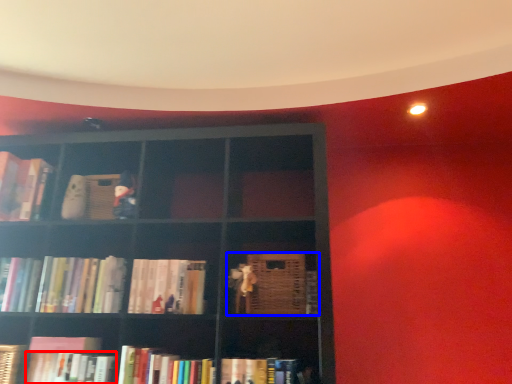
Question: Which object is further to the camera taking this photo, book (highlighted by a red box) or book (highlighted by a blue box)?

Choices:
 (A) book
 (B) book

Answer: (B)